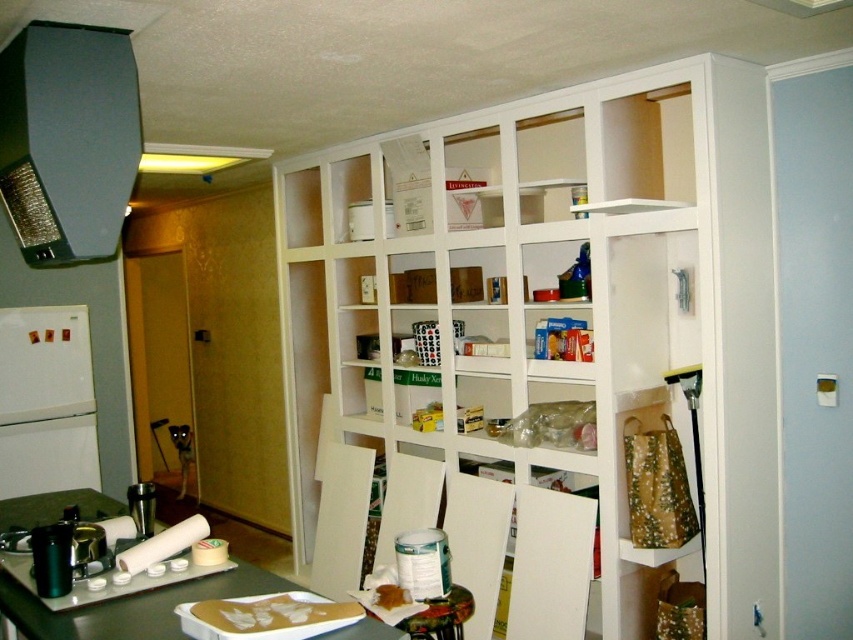
Question: Which point is farther to the camera?

Choices:
 (A) white matte pantry at center
 (B) white matte refrigerator at left
 (C) satin black exhaust hood at upper left

Answer: (B)

Question: Does satin black exhaust hood at upper left have a greater width compared to white cardboard box at upper center?

Choices:
 (A) yes
 (B) no

Answer: (A)

Question: Does white matte pantry at center have a greater width compared to white cardboard box at upper center?

Choices:
 (A) no
 (B) yes

Answer: (B)

Question: Which point is farther to the camera?

Choices:
 (A) (6, 104)
 (B) (706, 116)
 (C) (355, 227)
 (D) (38, 365)

Answer: (D)

Question: Which object appears farthest from the camera in this image?

Choices:
 (A) white cardboard box at upper center
 (B) white matte pantry at center
 (C) white matte refrigerator at left

Answer: (C)

Question: Does white matte refrigerator at left appear on the left side of white cardboard box at upper center?

Choices:
 (A) no
 (B) yes

Answer: (B)